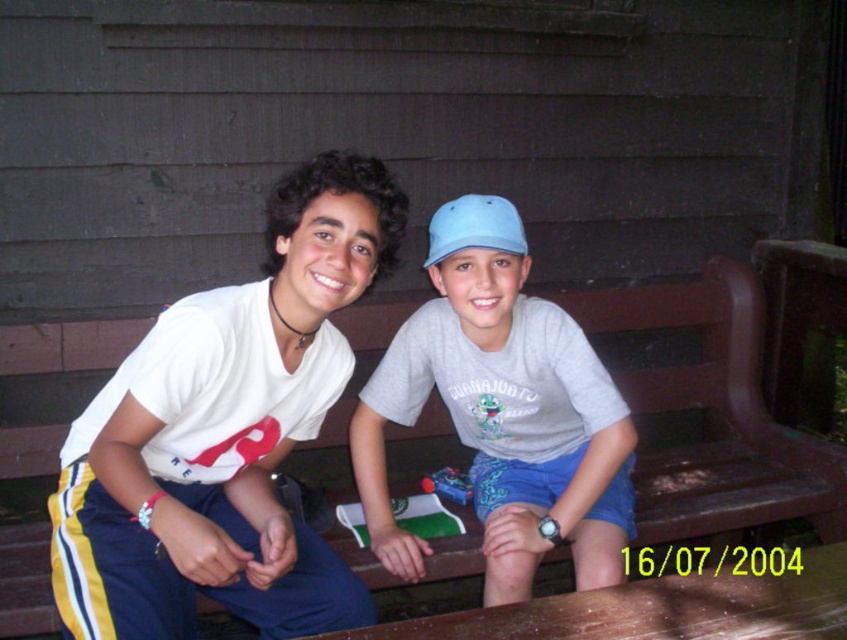
Question: Observing the image, what is the correct spatial positioning of gray cotton shirt at center in reference to light blue fabric baseball cap at center?

Choices:
 (A) left
 (B) right

Answer: (B)

Question: Does white matte t-shirt at center have a larger size compared to gray cotton shirt at center?

Choices:
 (A) yes
 (B) no

Answer: (A)

Question: Which is nearer to the brown wooden bench at center?

Choices:
 (A) gray cotton shirt at center
 (B) light blue fabric baseball cap at center
 (C) white matte t-shirt at center

Answer: (A)

Question: Among these points, which one is farthest from the camera?

Choices:
 (A) [x=174, y=452]
 (B) [x=472, y=211]

Answer: (B)

Question: Does white matte t-shirt at center appear over brown wooden bench at center?

Choices:
 (A) no
 (B) yes

Answer: (B)

Question: Which is farther from the light blue fabric baseball cap at center?

Choices:
 (A) white matte t-shirt at center
 (B) gray cotton shirt at center

Answer: (A)